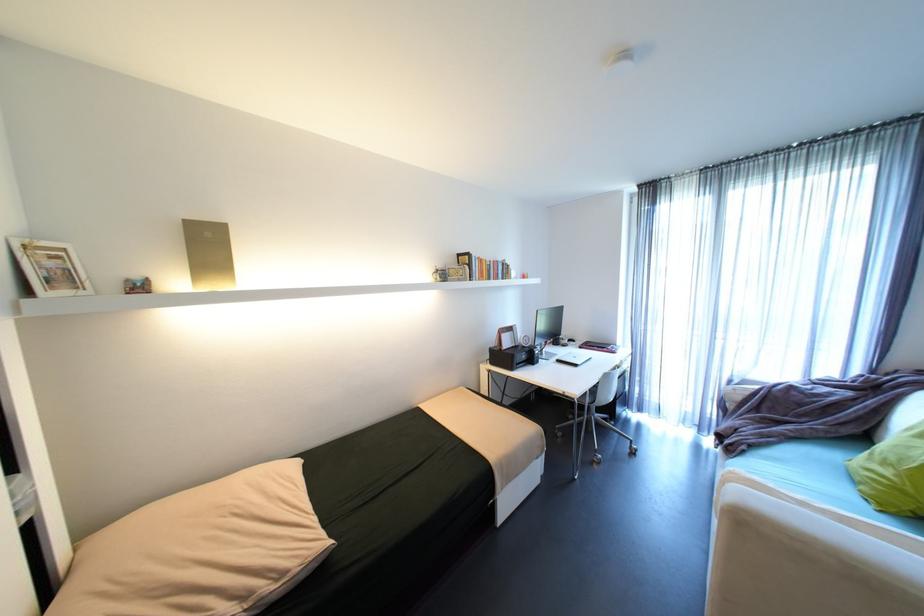
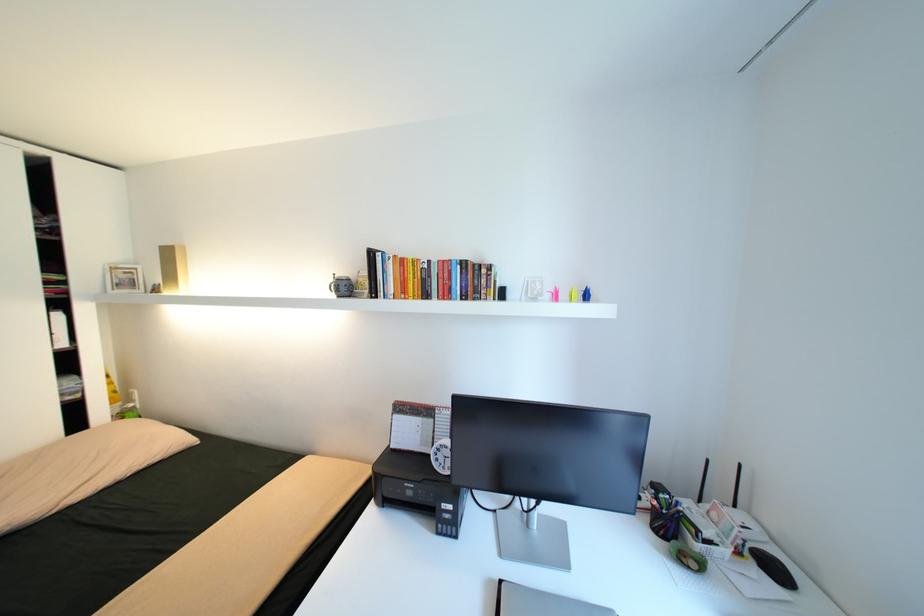
In the second image, find the point that corresponds to (144,278) in the first image.

(164, 284)